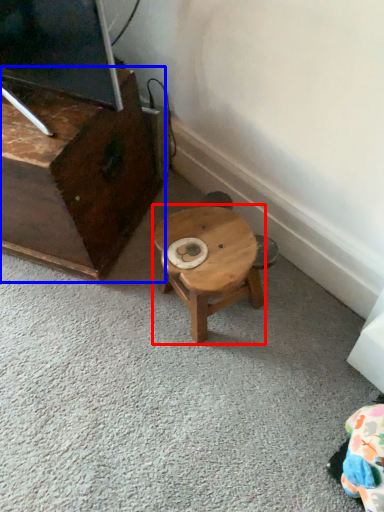
Question: Which of the following is the closest to the observer, stool (highlighted by a red box) or furniture (highlighted by a blue box)?

Choices:
 (A) stool
 (B) furniture

Answer: (B)